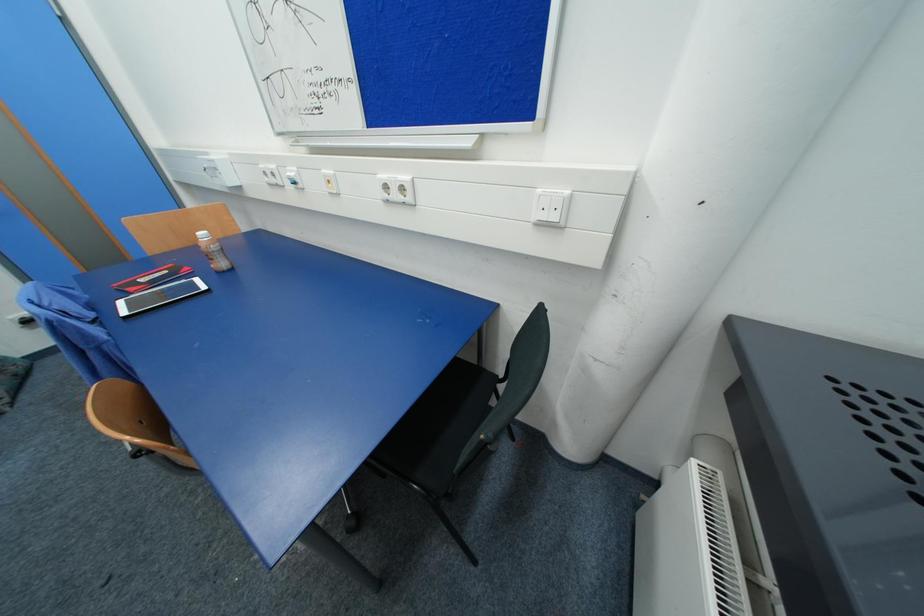
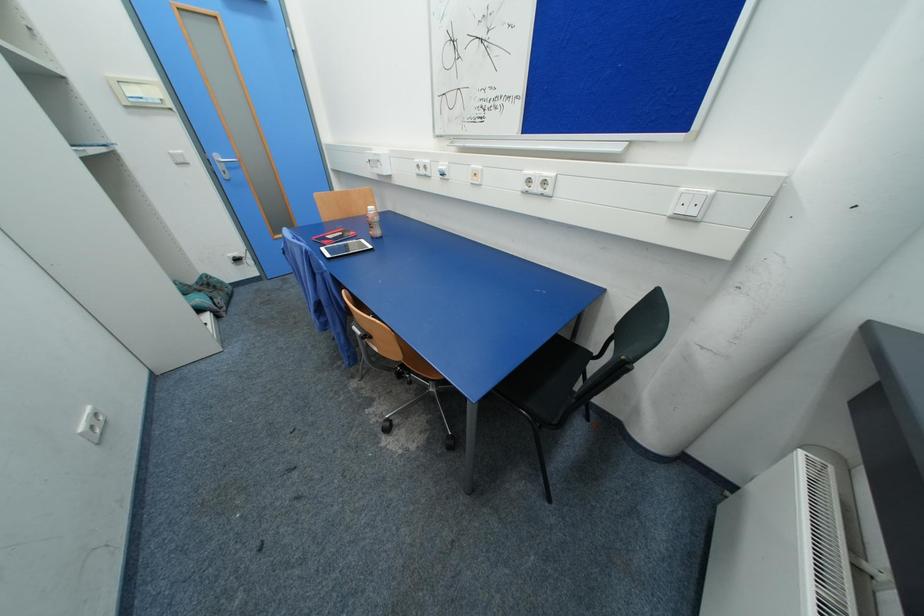
Question: The camera is either moving clockwise (left) or counter-clockwise (right) around the object. The first image is from the beginning of the video and the second image is from the end. Is the camera moving left or right when shooting the video?

Choices:
 (A) Left
 (B) Right

Answer: (B)